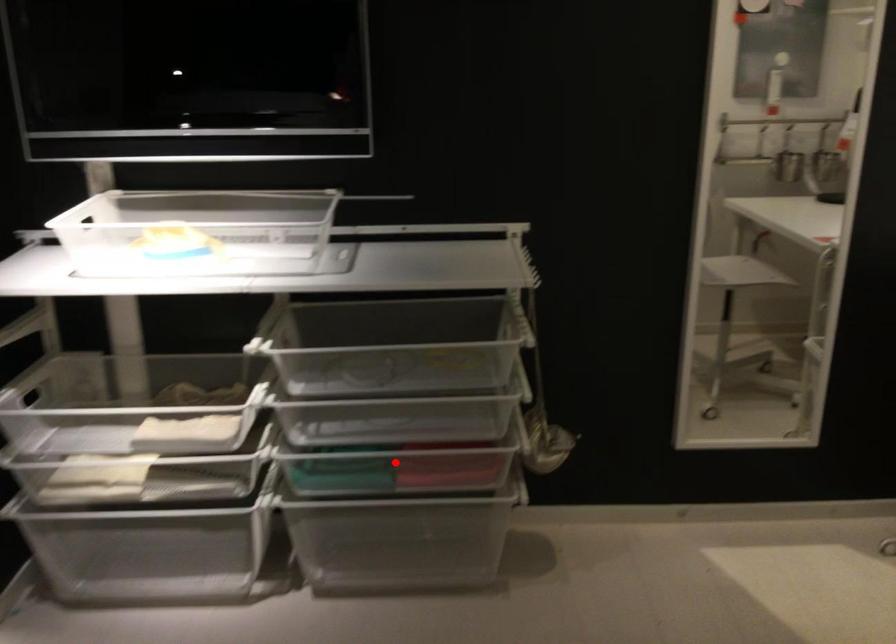
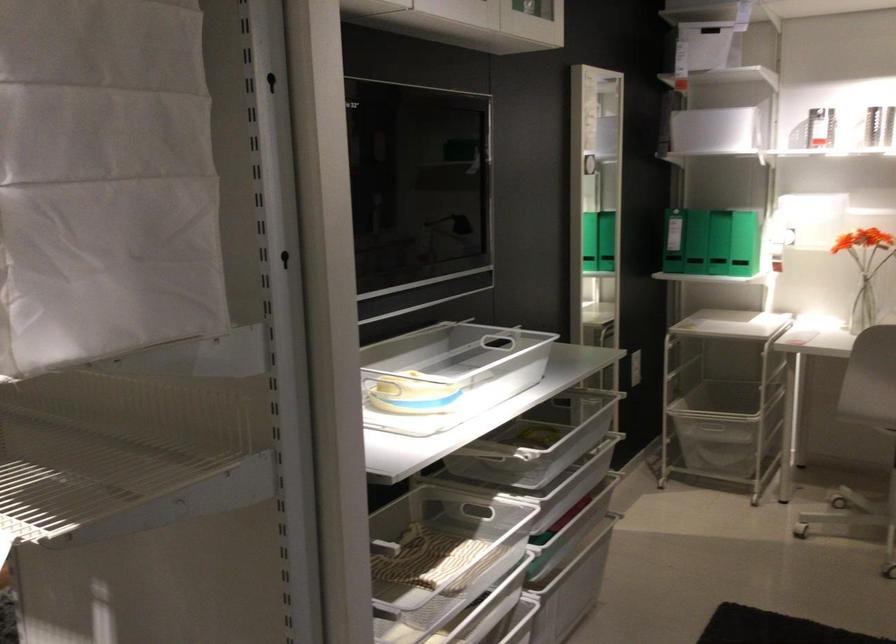
Question: I am providing you with two images of the same scene from different viewpoints. A red point is marked on the first image. Can you still see the location of the red point in image 2?

Choices:
 (A) Yes
 (B) No

Answer: (B)